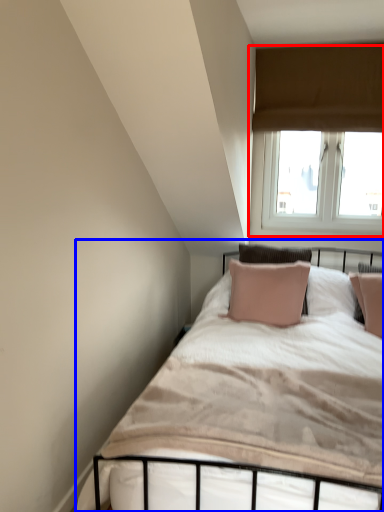
Question: Among these objects, which one is farthest to the camera, window (highlighted by a red box) or bed (highlighted by a blue box)?

Choices:
 (A) window
 (B) bed

Answer: (A)